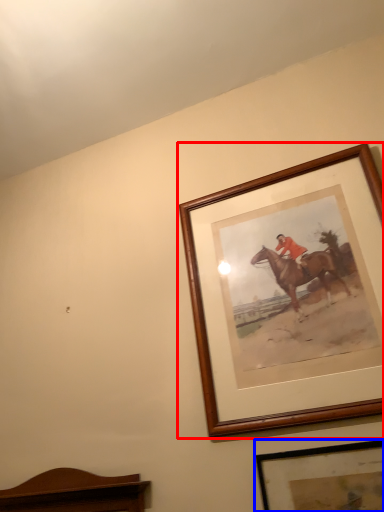
Question: Which object is further to the camera taking this photo, picture frame (highlighted by a red box) or picture frame (highlighted by a blue box)?

Choices:
 (A) picture frame
 (B) picture frame

Answer: (A)